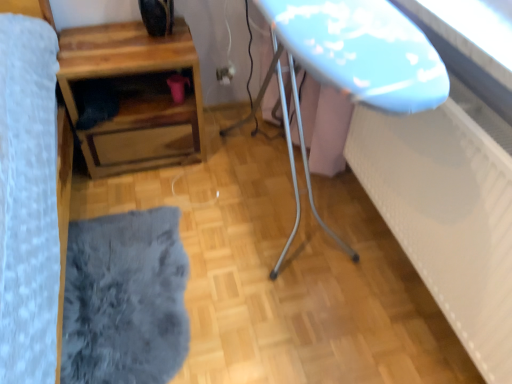
Question: Is there a large distance between matte plastic outlet at center and wooden table at lower left?

Choices:
 (A) yes
 (B) no

Answer: (B)

Question: Does matte plastic outlet at center lie in front of wooden table at lower left?

Choices:
 (A) yes
 (B) no

Answer: (B)

Question: Is matte plastic outlet at center at the left side of wooden table at lower left?

Choices:
 (A) no
 (B) yes

Answer: (A)

Question: Considering the relative sizes of matte plastic outlet at center and wooden table at lower left in the image provided, is matte plastic outlet at center taller than wooden table at lower left?

Choices:
 (A) no
 (B) yes

Answer: (A)

Question: Is matte plastic outlet at center to the right of wooden table at lower left from the viewer's perspective?

Choices:
 (A) yes
 (B) no

Answer: (A)

Question: Is fuzzy gray rug at lower left taller or shorter than wooden table at lower left?

Choices:
 (A) tall
 (B) short

Answer: (B)

Question: Considering their positions, is fuzzy gray rug at lower left located in front of or behind wooden table at lower left?

Choices:
 (A) front
 (B) behind

Answer: (A)

Question: Would you say fuzzy gray rug at lower left is to the left or to the right of wooden table at lower left in the picture?

Choices:
 (A) right
 (B) left

Answer: (A)

Question: Is fuzzy gray rug at lower left inside the boundaries of wooden table at lower left, or outside?

Choices:
 (A) outside
 (B) inside

Answer: (A)

Question: Considering the positions of matte plastic outlet at center and wooden table at lower left in the image, is matte plastic outlet at center bigger or smaller than wooden table at lower left?

Choices:
 (A) big
 (B) small

Answer: (B)

Question: Considering their positions, is matte plastic outlet at center located in front of or behind wooden table at lower left?

Choices:
 (A) front
 (B) behind

Answer: (B)

Question: Does point (223, 82) appear closer or farther from the camera than point (168, 43)?

Choices:
 (A) farther
 (B) closer

Answer: (A)

Question: Considering the relative positions of matte plastic outlet at center and wooden table at lower left in the image provided, is matte plastic outlet at center to the left or to the right of wooden table at lower left?

Choices:
 (A) right
 (B) left

Answer: (A)

Question: Looking at their shapes, would you say wooden table at lower left is wider or thinner than matte plastic outlet at center?

Choices:
 (A) wide
 (B) thin

Answer: (A)

Question: Is wooden table at lower left spatially inside matte plastic outlet at center, or outside of it?

Choices:
 (A) inside
 (B) outside

Answer: (B)